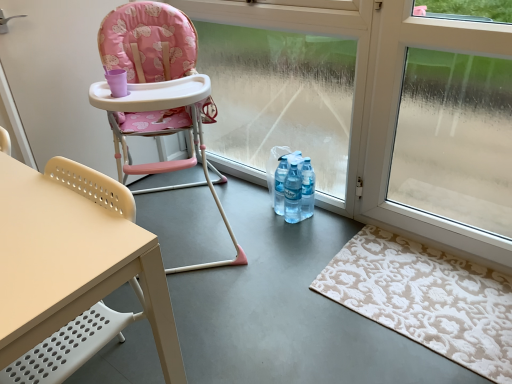
Where is `vacant area situated below pink fabric highchair at left, marked as the 2th chair in a front-to-back arrangement (from a real-world perspective)`? This screenshot has height=384, width=512. vacant area situated below pink fabric highchair at left, marked as the 2th chair in a front-to-back arrangement (from a real-world perspective) is located at coordinates (186, 220).